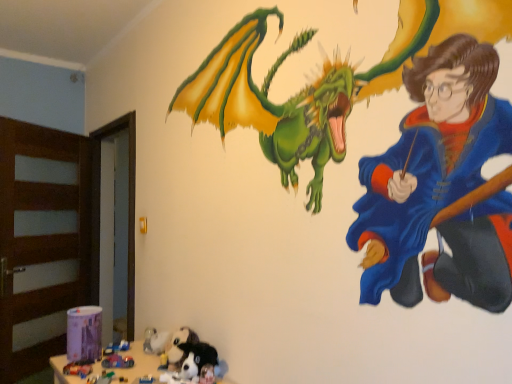
Question: Is plastic toy car at lower left, which ranks as the 3th toy in front-to-back order, at the right side of shiny plastic toy car at lower left, the 2th toy when ordered from back to front?

Choices:
 (A) yes
 (B) no

Answer: (B)

Question: Is plastic toy car at lower left, which ranks as the 3th toy in front-to-back order, outside shiny plastic toy car at lower left, the 2th toy when ordered from back to front?

Choices:
 (A) yes
 (B) no

Answer: (A)

Question: Can you confirm if plastic toy car at lower left, which ranks as the 3th toy in front-to-back order, is thinner than shiny plastic toy car at lower left, which is the second toy in front-to-back order?

Choices:
 (A) yes
 (B) no

Answer: (A)

Question: Does plastic toy car at lower left, which is counted as the 1th toy, starting from the back, have a lesser height compared to shiny plastic toy car at lower left, the 2th toy when ordered from back to front?

Choices:
 (A) yes
 (B) no

Answer: (A)

Question: Considering the relative positions of plastic toy car at lower left, which is counted as the 1th toy, starting from the back, and shiny plastic toy car at lower left, the 2th toy when ordered from back to front, in the image provided, is plastic toy car at lower left, which is counted as the 1th toy, starting from the back, to the left of shiny plastic toy car at lower left, the 2th toy when ordered from back to front, from the viewer's perspective?

Choices:
 (A) yes
 (B) no

Answer: (A)

Question: Based on their positions, is soft plush dog at lower center, marked as the first animal in a front-to-back arrangement, located to the left or right of plastic toy car at lower left, which ranks as the 3th toy in front-to-back order?

Choices:
 (A) left
 (B) right

Answer: (B)

Question: Considering the positions of point (196, 362) and point (128, 345), is point (196, 362) closer or farther from the camera than point (128, 345)?

Choices:
 (A) closer
 (B) farther

Answer: (A)

Question: From a real-world perspective, relative to plastic toy car at lower left, which ranks as the 3th toy in front-to-back order, is soft plush dog at lower center, the second animal when ordered from back to front, vertically above or below?

Choices:
 (A) below
 (B) above

Answer: (B)

Question: Is soft plush dog at lower center, marked as the first animal in a front-to-back arrangement, bigger or smaller than plastic toy car at lower left, which is counted as the 1th toy, starting from the back?

Choices:
 (A) small
 (B) big

Answer: (B)

Question: From the image's perspective, is shiny plastic toy car at lower left, which is the second toy in front-to-back order, above or below plastic toy car at lower left, which is counted as the 1th toy, starting from the back?

Choices:
 (A) below
 (B) above

Answer: (B)

Question: Does point (128, 359) appear closer or farther from the camera than point (125, 344)?

Choices:
 (A) closer
 (B) farther

Answer: (A)

Question: Do you think shiny plastic toy car at lower left, the 2th toy when ordered from back to front, is within plastic toy car at lower left, which ranks as the 3th toy in front-to-back order, or outside of it?

Choices:
 (A) outside
 (B) inside

Answer: (A)

Question: In terms of size, does shiny plastic toy car at lower left, which is the second toy in front-to-back order, appear bigger or smaller than plastic toy car at lower left, which ranks as the 3th toy in front-to-back order?

Choices:
 (A) small
 (B) big

Answer: (B)

Question: Considering their positions, is plastic toy car at lower left, which ranks as the 3th toy in front-to-back order, located in front of or behind plastic toy car at lower left, the third toy from the back?

Choices:
 (A) front
 (B) behind

Answer: (B)

Question: From the image's perspective, is plastic toy car at lower left, which ranks as the 3th toy in front-to-back order, located above or below plastic toy car at lower left, which is the first toy from front to back?

Choices:
 (A) below
 (B) above

Answer: (A)